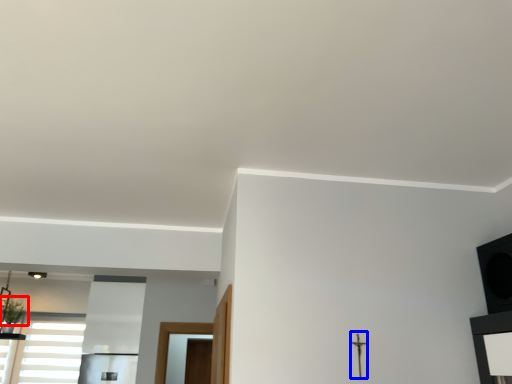
Question: Among these objects, which one is nearest to the camera, plant (highlighted by a red box) or crucifix (highlighted by a blue box)?

Choices:
 (A) plant
 (B) crucifix

Answer: (B)